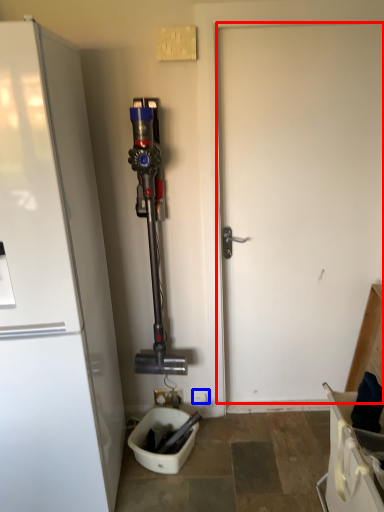
Question: Which point is closer to the camera, door (highlighted by a red box) or electric outlet (highlighted by a blue box)?

Choices:
 (A) door
 (B) electric outlet

Answer: (A)